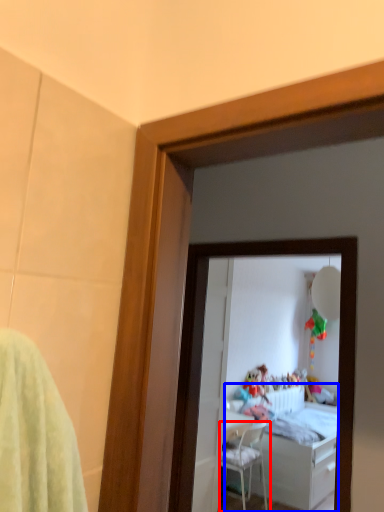
Question: Which point is closer to the camera, chair (highlighted by a red box) or bed (highlighted by a blue box)?

Choices:
 (A) chair
 (B) bed

Answer: (A)